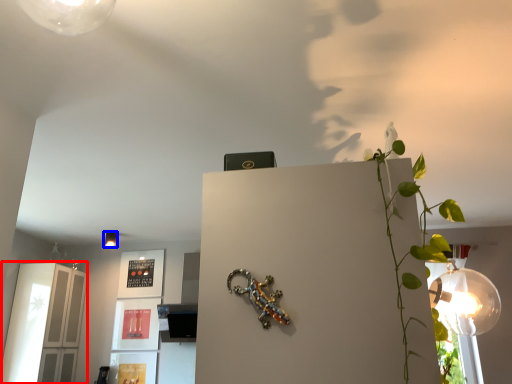
Question: Which point is closer to the camera, glass door (highlighted by a red box) or lamp (highlighted by a blue box)?

Choices:
 (A) glass door
 (B) lamp

Answer: (A)